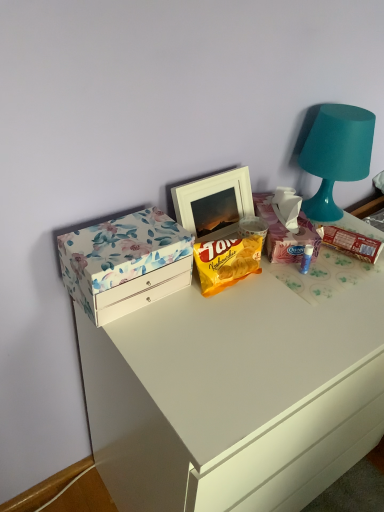
The width and height of the screenshot is (384, 512). Identify the location of vacant space in front of yellow matte snack packet at center, the first snack when ordered from left to right. (238, 329).